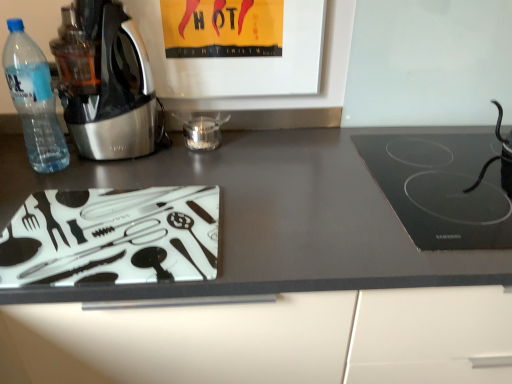
Find the location of `vacant position to the left of transparent glass jar at center, arranged as the first appliance when viewed from the left`. vacant position to the left of transparent glass jar at center, arranged as the first appliance when viewed from the left is located at coordinates (156, 147).